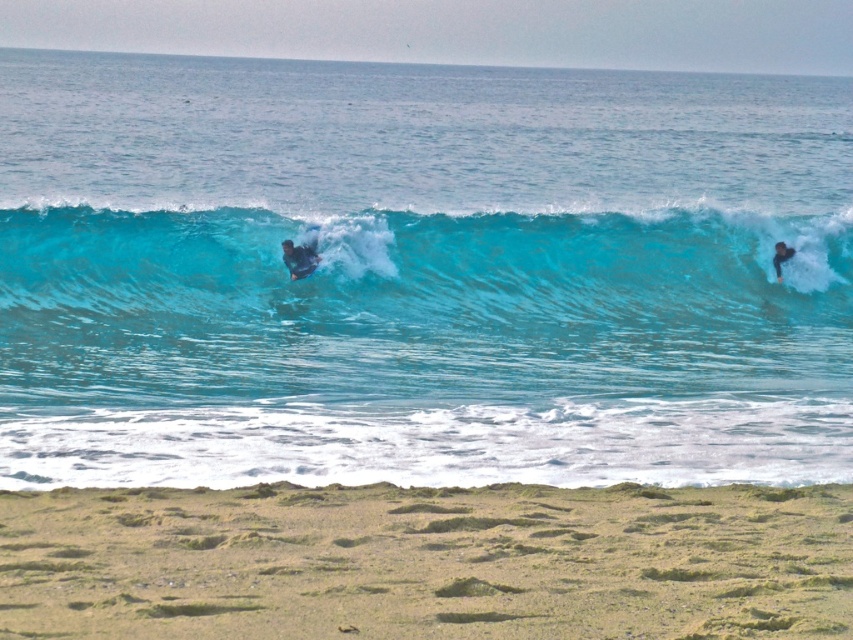
You are a photographer trying to capture the perfect shot of the blue glossy water at center and the smooth black wetsuit at center. Based on their heights, which one would appear larger in the photo?

The blue glossy water at center appears larger in the photo because it has a greater height compared to the smooth black wetsuit at center.

You are standing on the beach and see the blue glossy water at center and the dark blue wetsuit at right. Which object is closer to the left side of the image?

The blue glossy water at center is closer to the left side of the image because it is positioned to the left of the dark blue wetsuit at right.